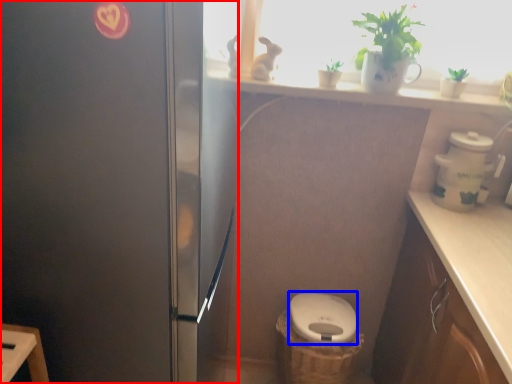
Question: Which of the following is the closest to the observer, fridge (highlighted by a red box) or toilet bowl (highlighted by a blue box)?

Choices:
 (A) fridge
 (B) toilet bowl

Answer: (A)